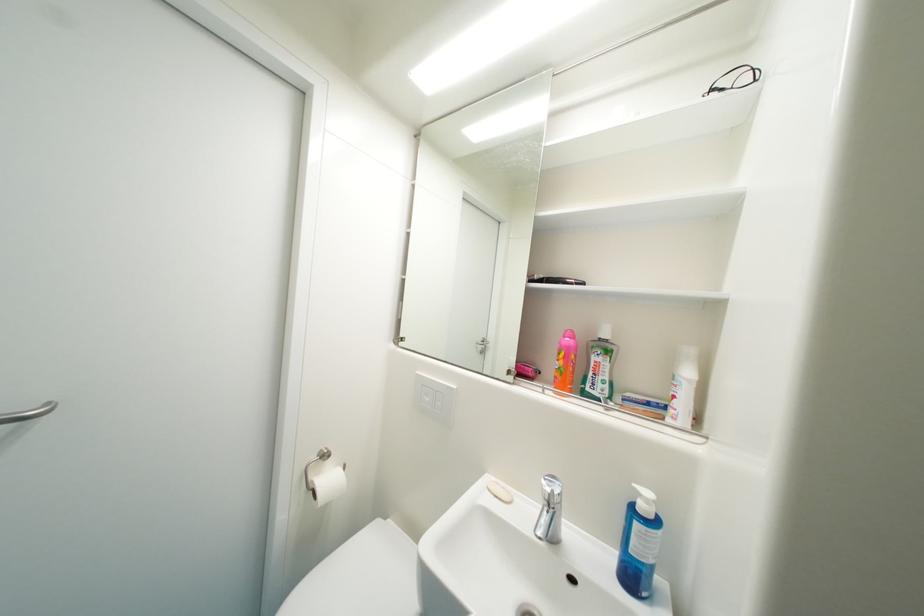
Image resolution: width=924 pixels, height=616 pixels. What do you see at coordinates (28, 413) in the screenshot?
I see `a silver door handle` at bounding box center [28, 413].